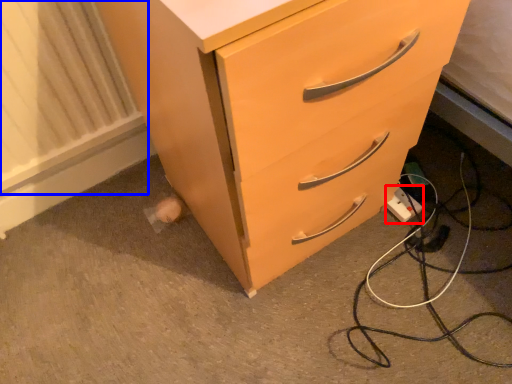
Question: Which object is further to the camera taking this photo, electric outlet (highlighted by a red box) or radiator (highlighted by a blue box)?

Choices:
 (A) electric outlet
 (B) radiator

Answer: (A)